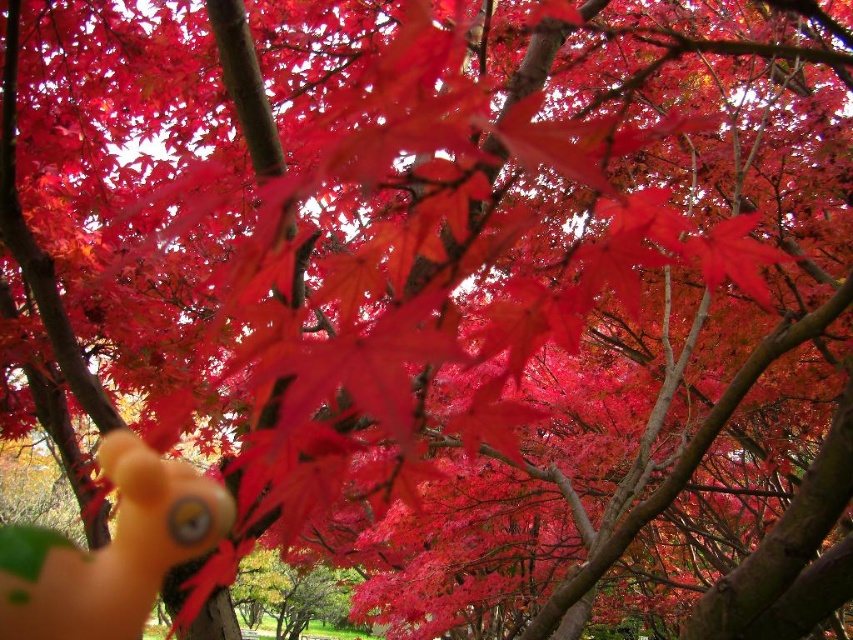
Is point (148, 452) in front of point (766, 292)?

Yes.

Does rubber duck at lower left appear over glossy red maple leaf at upper right?

No.

Does point (10, 604) come in front of point (740, 259)?

No, it is not.

Where is `rubber duck at lower left`? The height and width of the screenshot is (640, 853). rubber duck at lower left is located at coordinates (111, 548).